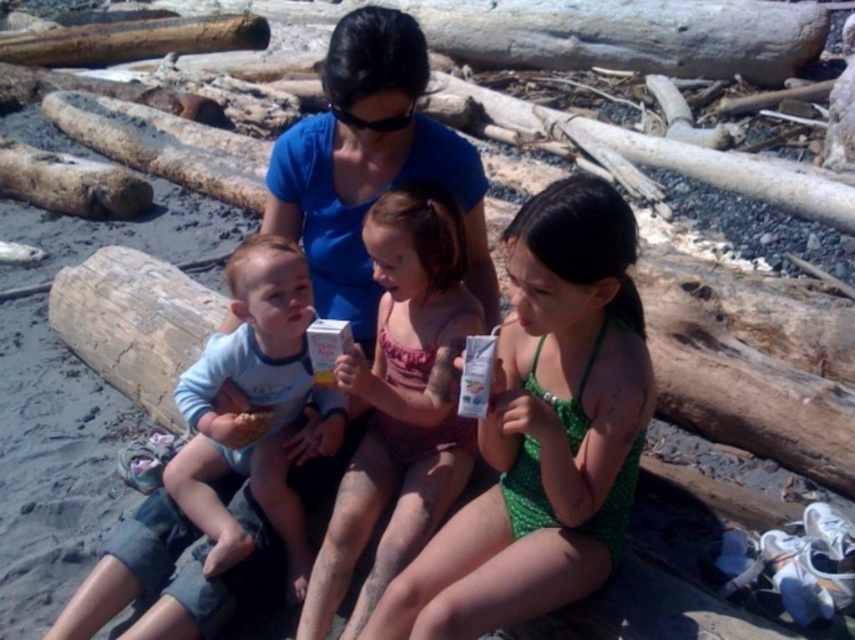
You are a photographer trying to capture a closeup of the matte pink swimsuit at center and the light blue cotton shirt at center. Which object should you focus on first if you want to ensure both are in focus without adjusting your camera settings?

The matte pink swimsuit at center is closer to the viewer than the light blue cotton shirt at center. To ensure both are in focus, focus on the matte pink swimsuit at center first since it is closer, allowing the light blue cotton shirt at center to fall within the depth of field.

You are a photographer trying to capture a candid shot of the two central figures in the beach scene. The pink fabric swimsuit at center and the light blue cotton shirt at center are both in your frame. Based on their positions, which one is positioned to the right side of the other?

The pink fabric swimsuit at center is to the right of the light blue cotton shirt at center, so the pink fabric swimsuit at center is positioned to the right of the light blue cotton shirt at center.